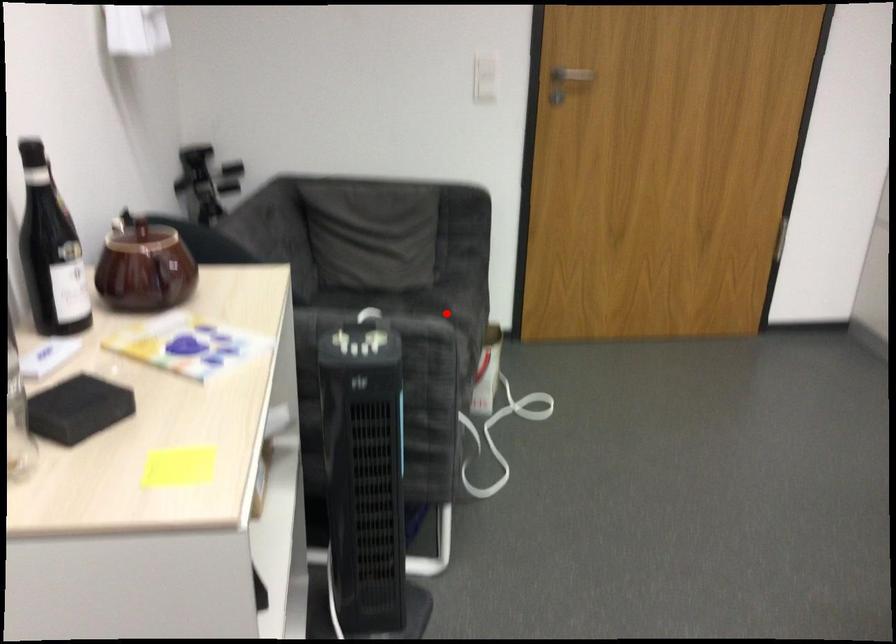
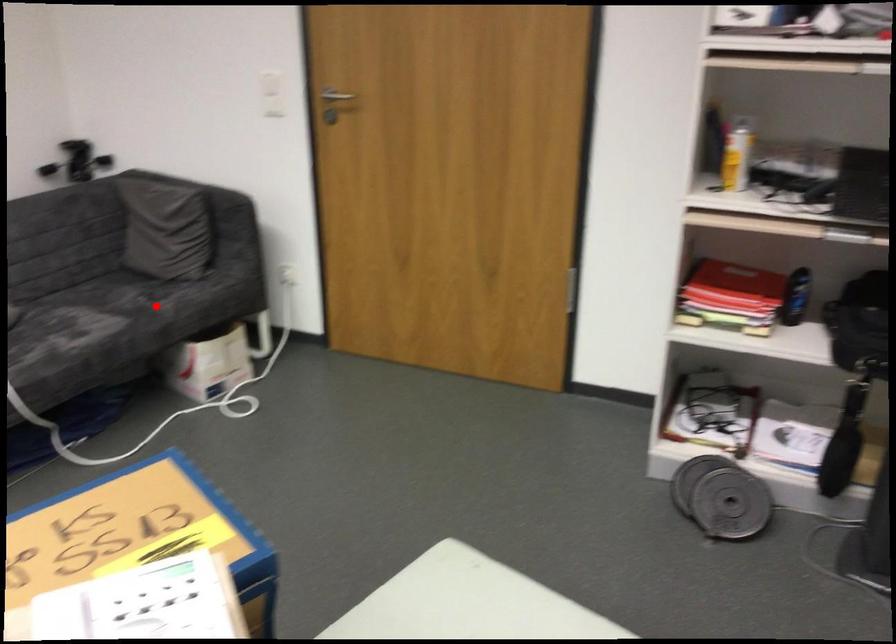
I am providing you with two images of the same scene from different viewpoints. A red point is marked on the first image and another point is marked on the second image. Does the point marked in image1 correspond to the same location as the one in image2?

Yes